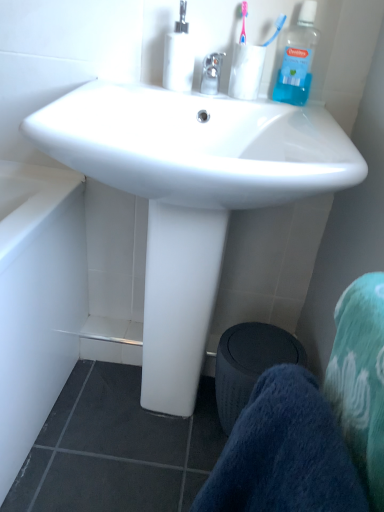
Question: Can you confirm if blue soft towel at lower right is taller than blue plastic toothbrush at upper right?

Choices:
 (A) no
 (B) yes

Answer: (B)

Question: From a real-world perspective, is blue soft towel at lower right over blue plastic toothbrush at upper right?

Choices:
 (A) no
 (B) yes

Answer: (A)

Question: Is blue soft towel at lower right positioned behind blue plastic toothbrush at upper right?

Choices:
 (A) no
 (B) yes

Answer: (A)

Question: Is blue soft towel at lower right touching blue plastic toothbrush at upper right?

Choices:
 (A) yes
 (B) no

Answer: (B)

Question: Can you confirm if blue soft towel at lower right is thinner than blue plastic toothbrush at upper right?

Choices:
 (A) yes
 (B) no

Answer: (B)

Question: From the image's perspective, is blue plastic toothbrush at upper right located above or below black fabric trash bin/can at lower center?

Choices:
 (A) above
 (B) below

Answer: (A)

Question: Considering their positions, is blue plastic toothbrush at upper right located in front of or behind black fabric trash bin/can at lower center?

Choices:
 (A) behind
 (B) front

Answer: (B)

Question: Is blue plastic toothbrush at upper right taller or shorter than black fabric trash bin/can at lower center?

Choices:
 (A) tall
 (B) short

Answer: (B)

Question: Is blue plastic toothbrush at upper right spatially inside black fabric trash bin/can at lower center, or outside of it?

Choices:
 (A) inside
 (B) outside

Answer: (B)

Question: From the image's perspective, relative to white glossy sink at center, is blue soft towel at lower right above or below?

Choices:
 (A) below
 (B) above

Answer: (A)

Question: Is blue soft towel at lower right bigger or smaller than white glossy sink at center?

Choices:
 (A) small
 (B) big

Answer: (A)

Question: In the image, is blue soft towel at lower right positioned in front of or behind white glossy sink at center?

Choices:
 (A) front
 (B) behind

Answer: (A)

Question: From their relative heights in the image, would you say blue soft towel at lower right is taller or shorter than white glossy sink at center?

Choices:
 (A) tall
 (B) short

Answer: (B)

Question: Is clear glass faucet at center in front of or behind blue plastic toothbrush at upper right in the image?

Choices:
 (A) front
 (B) behind

Answer: (A)

Question: Considering the positions of clear glass faucet at center and blue plastic toothbrush at upper right in the image, is clear glass faucet at center wider or thinner than blue plastic toothbrush at upper right?

Choices:
 (A) wide
 (B) thin

Answer: (A)